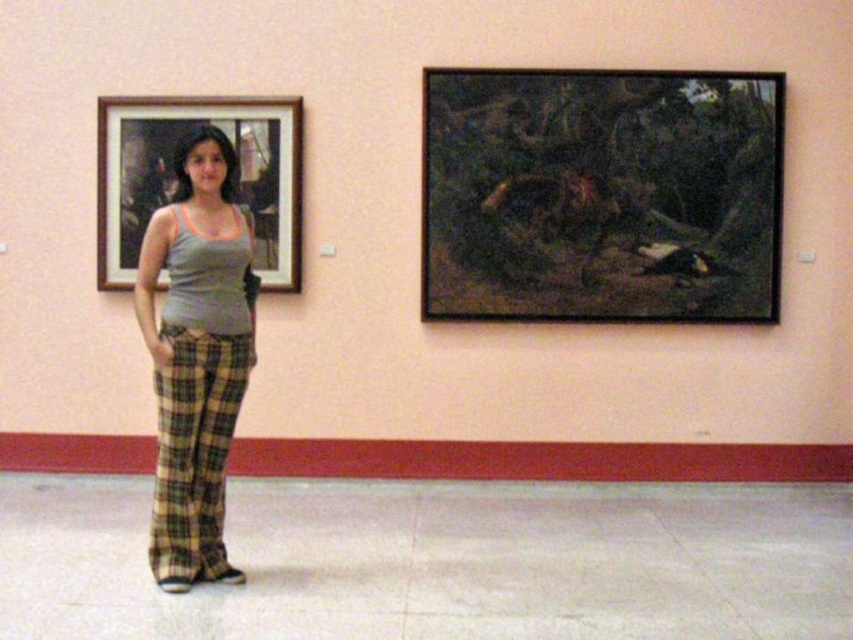
Question: Observing the image, what is the correct spatial positioning of dark brown wooden picture frame at upper right in reference to matte gray tank top at center?

Choices:
 (A) right
 (B) left

Answer: (A)

Question: Based on their relative distances, which object is farther from the matte gray tank top at center?

Choices:
 (A) dark brown wooden picture frame at upper right
 (B) yellow plaid pants at center

Answer: (A)

Question: Among these objects, which one is nearest to the camera?

Choices:
 (A) dark brown wooden picture frame at upper right
 (B) yellow plaid pants at center
 (C) matte gray tank top at center

Answer: (C)

Question: Which of the following is the closest to the observer?

Choices:
 (A) (746, 150)
 (B) (160, 529)
 (C) (154, 545)

Answer: (B)

Question: Does dark brown wooden picture frame at upper right have a greater width compared to wooden framed portrait at left?

Choices:
 (A) no
 (B) yes

Answer: (B)

Question: Can you confirm if dark brown wooden picture frame at upper right is positioned to the left of yellow plaid pants at center?

Choices:
 (A) yes
 (B) no

Answer: (B)